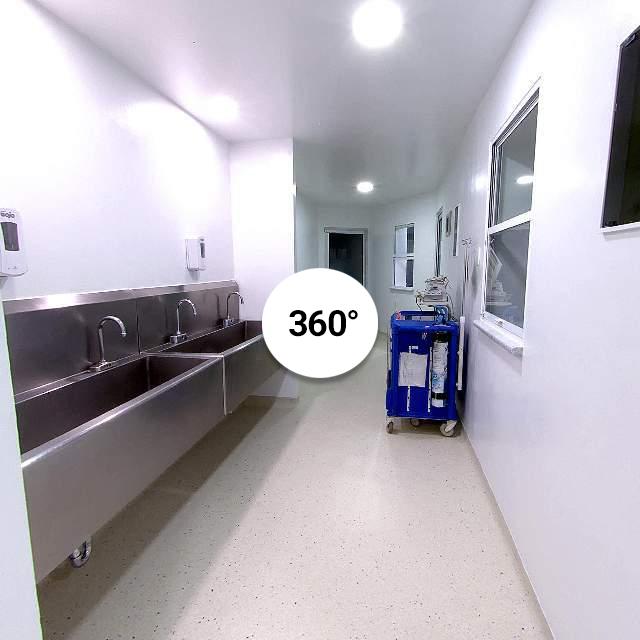
Identify the location of wall. This screenshot has width=640, height=640. (584, 301), (116, 209).